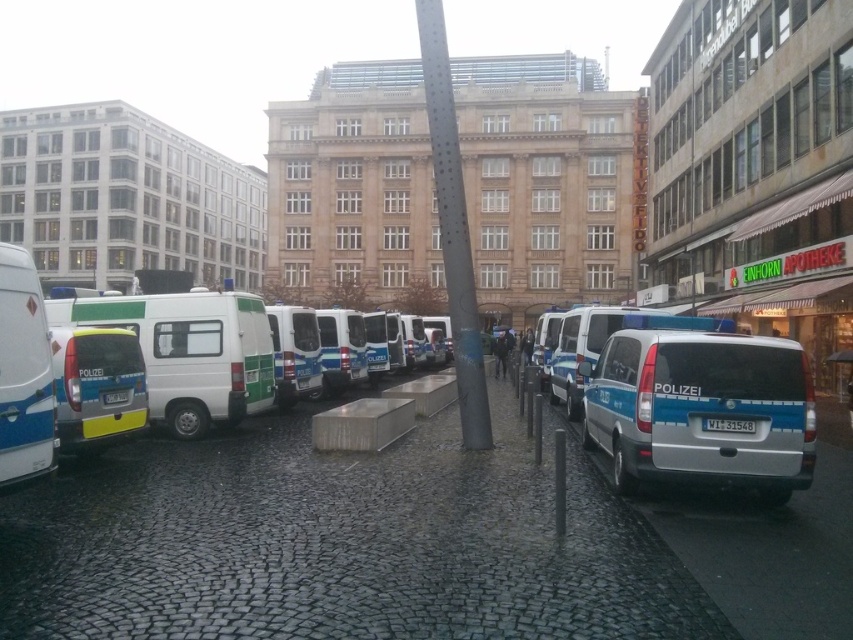
Does cobblestone pavement at center appear on the right side of silver metallic van at right?

No, cobblestone pavement at center is not to the right of silver metallic van at right.

Is cobblestone pavement at center closer to the viewer compared to silver metallic van at right?

That is True.

At what (x,y) coordinates should I click in order to perform the action: click on cobblestone pavement at center. Please return your answer as a coordinate pair (x, y). The image size is (853, 640). Looking at the image, I should click on click(339, 544).

Can you confirm if silver metallic van at right is wider than white matte van at center?

No, silver metallic van at right is not wider than white matte van at center.

Who is taller, silver metallic van at right or white matte van at center?

With more height is white matte van at center.

Which is behind, point (701, 356) or point (120, 321)?

Point (120, 321)

Identify the location of silver metallic van at right. (701, 410).

Does white matte van at center have a greater width compared to matte white van at left?

Indeed, white matte van at center has a greater width compared to matte white van at left.

Can you confirm if white matte van at center is bigger than matte white van at left?

Yes.

Find the location of `white matte van at center`. white matte van at center is located at coordinates (190, 353).

The height and width of the screenshot is (640, 853). In order to click on white matte van at center in this screenshot , I will do `click(190, 353)`.